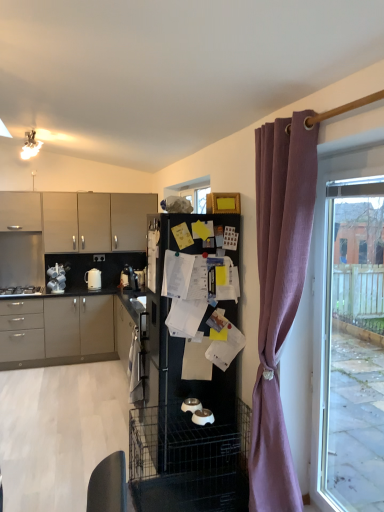
Question: Does white glossy pet bowls at center, the 4th appliance positioned from the back, have a smaller size compared to matte gray cabinets at left, arranged as the 3th cabinetry when viewed from the top?

Choices:
 (A) yes
 (B) no

Answer: (A)

Question: Would you say white glossy pet bowls at center, the 4th appliance positioned from the back, is outside matte gray cabinets at left, positioned as the first cabinetry in bottom-to-top order?

Choices:
 (A) no
 (B) yes

Answer: (B)

Question: Could you tell me if white glossy pet bowls at center, the fourth appliance in the left-to-right sequence, is turned towards matte gray cabinets at left, positioned as the first cabinetry in bottom-to-top order?

Choices:
 (A) yes
 (B) no

Answer: (B)

Question: From a real-world perspective, is white glossy pet bowls at center, the 4th appliance positioned from the back, below matte gray cabinets at left, positioned as the first cabinetry in bottom-to-top order?

Choices:
 (A) yes
 (B) no

Answer: (B)

Question: Is white glossy pet bowls at center, the 4th appliance positioned from the back, at the right side of matte gray cabinets at left, arranged as the 3th cabinetry when viewed from the top?

Choices:
 (A) yes
 (B) no

Answer: (A)

Question: From a real-world perspective, is white glossy pet bowls at center, which ranks as the 1th appliance in bottom-to-top order, positioned over matte gray cabinets at left, positioned as the first cabinetry in bottom-to-top order, based on gravity?

Choices:
 (A) no
 (B) yes

Answer: (B)

Question: Does stainless steel gas stove at left lie behind matte beige cabinet at upper left, the third cabinetry ordered from the bottom?

Choices:
 (A) yes
 (B) no

Answer: (B)

Question: Does stainless steel gas stove at left turn towards matte beige cabinet at upper left, marked as the first cabinetry in a top-to-bottom arrangement?

Choices:
 (A) yes
 (B) no

Answer: (B)

Question: From a real-world perspective, is stainless steel gas stove at left under matte beige cabinet at upper left, the third cabinetry ordered from the bottom?

Choices:
 (A) no
 (B) yes

Answer: (B)

Question: Does stainless steel gas stove at left have a larger size compared to matte beige cabinet at upper left, marked as the first cabinetry in a top-to-bottom arrangement?

Choices:
 (A) no
 (B) yes

Answer: (A)

Question: Can you confirm if stainless steel gas stove at left is wider than matte beige cabinet at upper left, the third cabinetry ordered from the bottom?

Choices:
 (A) yes
 (B) no

Answer: (A)

Question: Is stainless steel gas stove at left oriented away from matte beige cabinet at upper left, the third cabinetry ordered from the bottom?

Choices:
 (A) yes
 (B) no

Answer: (B)

Question: Is white glossy kettle at left, acting as the first appliance starting from the left, oriented away from clear glass window at right?

Choices:
 (A) no
 (B) yes

Answer: (A)